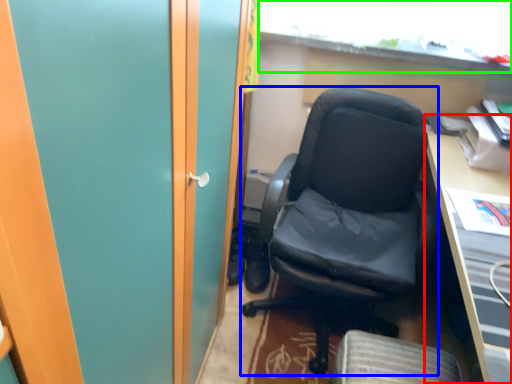
Question: Considering the real-world distances, which object is closest to desk (highlighted by a red box)? chair (highlighted by a blue box) or window (highlighted by a green box).

Choices:
 (A) chair
 (B) window

Answer: (A)